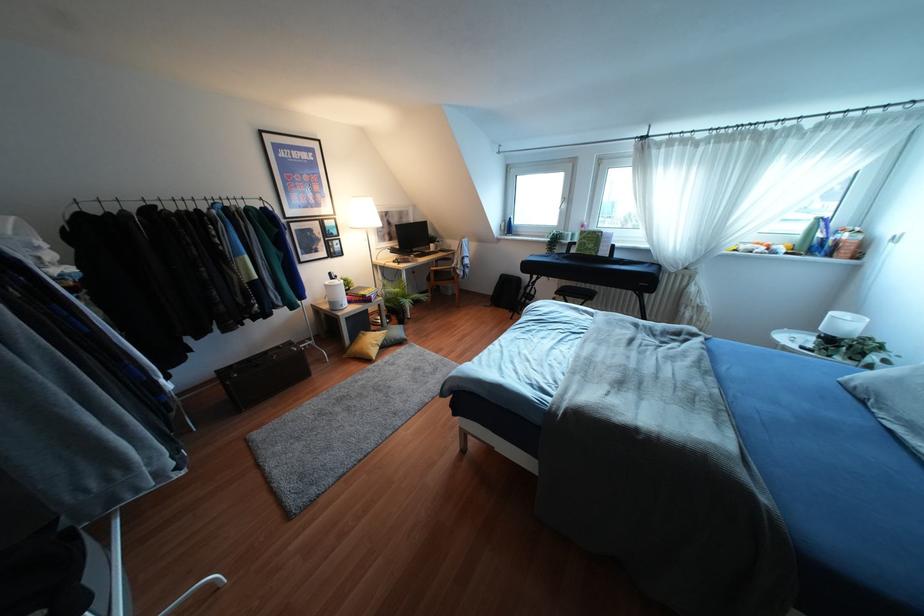
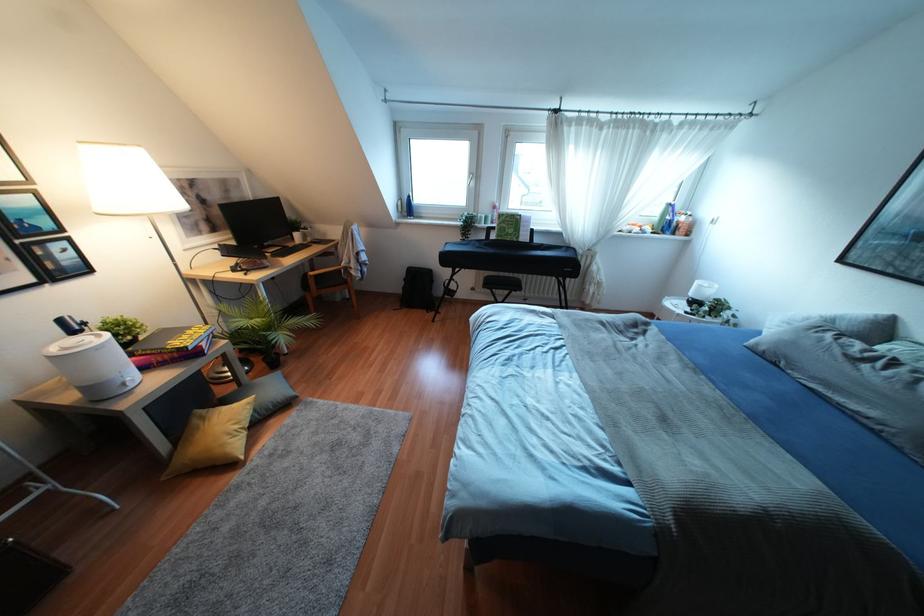
Question: The camera is either moving clockwise (left) or counter-clockwise (right) around the object. The first image is from the beginning of the video and the second image is from the end. Is the camera moving left or right when shooting the video?

Choices:
 (A) Left
 (B) Right

Answer: (A)